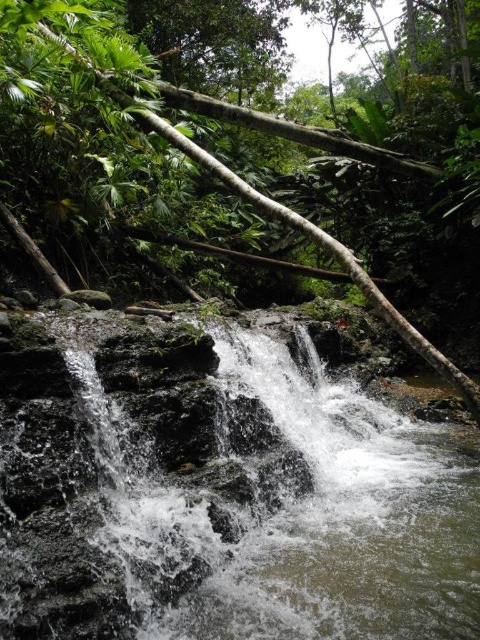
Can you confirm if clear water at center is thinner than green rough log at center?

Yes, clear water at center is thinner than green rough log at center.

Who is higher up, clear water at center or green rough log at center?

green rough log at center

Does point (207, 337) come farther from viewer compared to point (144, 115)?

No, (207, 337) is in front of (144, 115).

I want to click on clear water at center, so click(x=218, y=492).